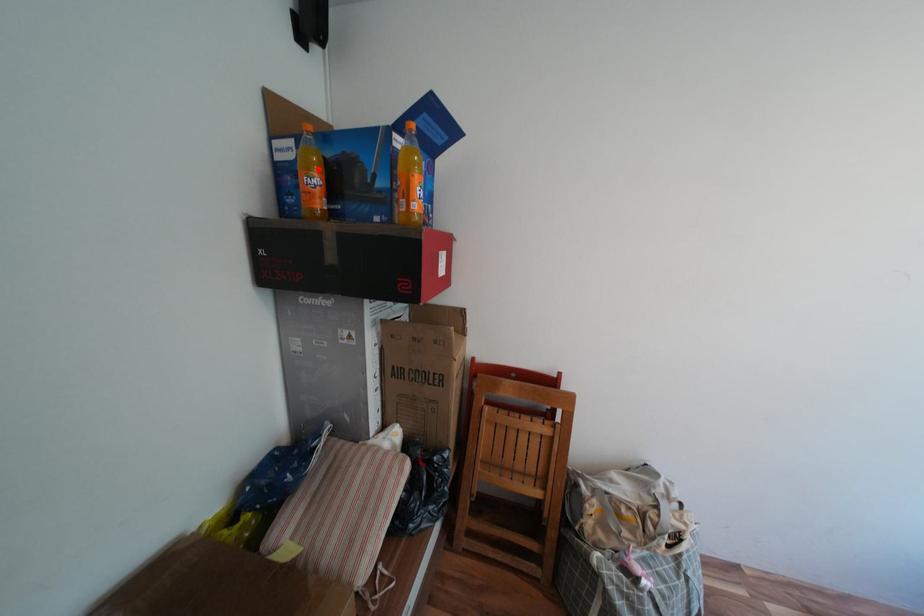
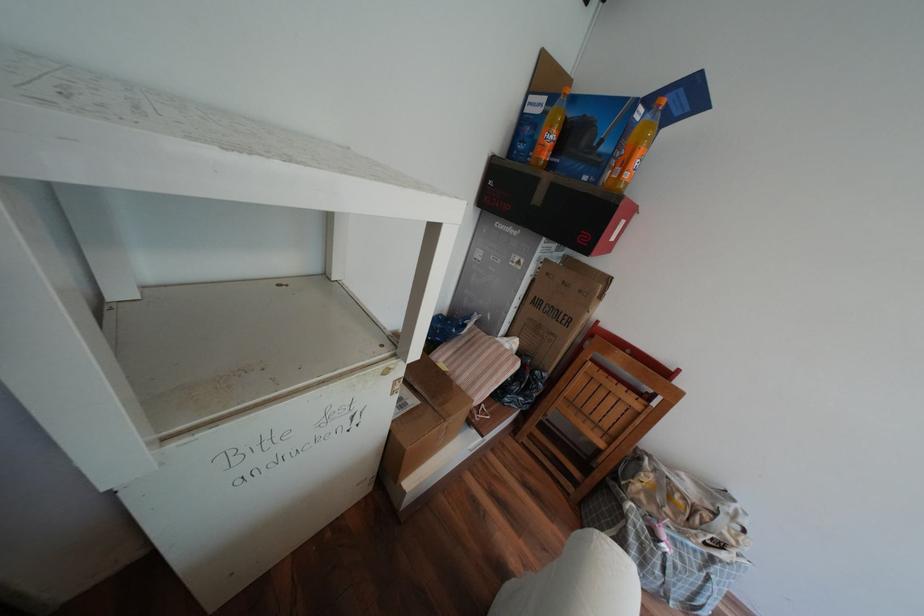
Find the pixel in the second image that matches the highlighted location in the first image.

(561, 127)